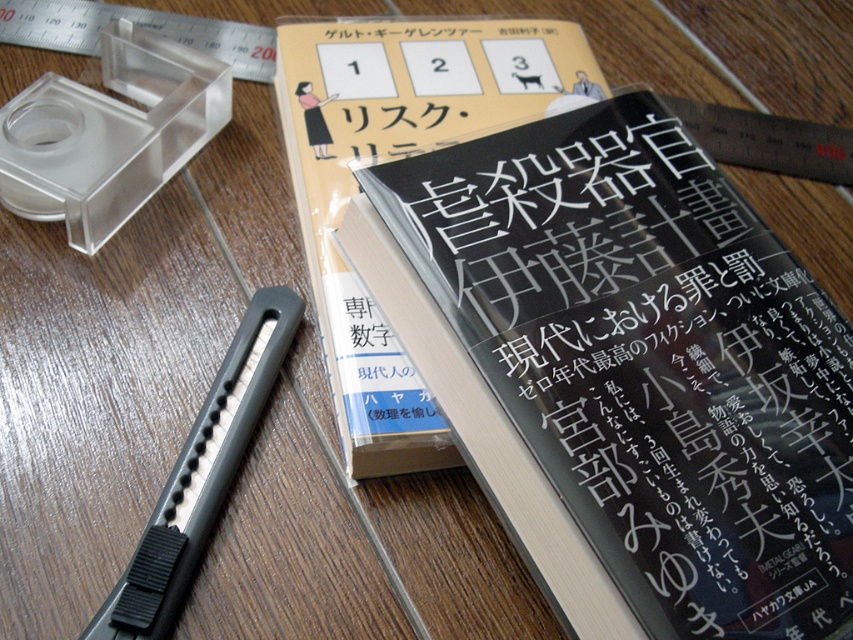
You are standing 30 inches away from the camera. Can you reach the black glossy book at center without moving closer?

The black glossy book at center is 34.22 inches away from the camera. Since you are 30 inches away from the camera, you are 4.22 inches too far to reach it without moving closer.

You are organizing books on a shelf and need to know which one is bigger. Which is larger between the black glossy book at center and the black matte book at center?

The black glossy book at center is larger in size than the black matte book at center.